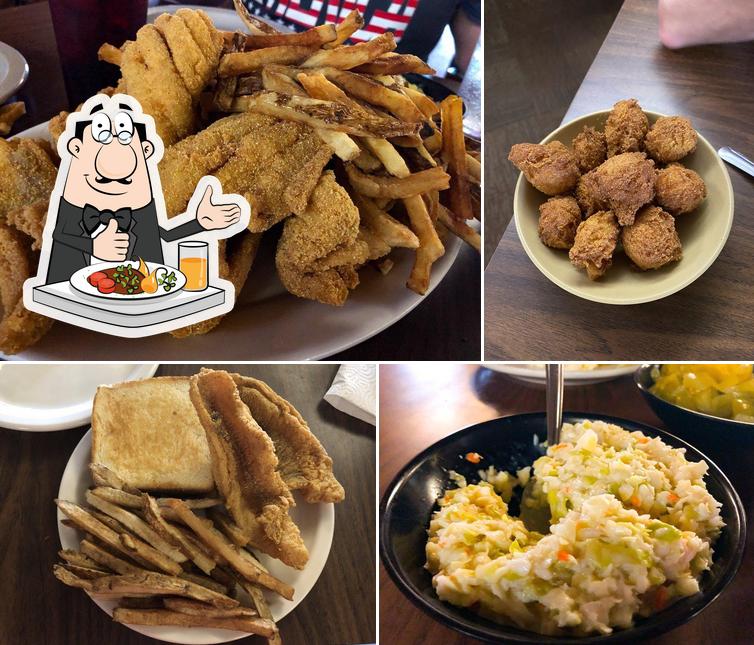
At what (x,y) coordinates should I click in order to perform the action: click on cutlery. Please return your answer as a coordinate pair (x, y). The image size is (754, 645). Looking at the image, I should click on (553, 397), (737, 163).